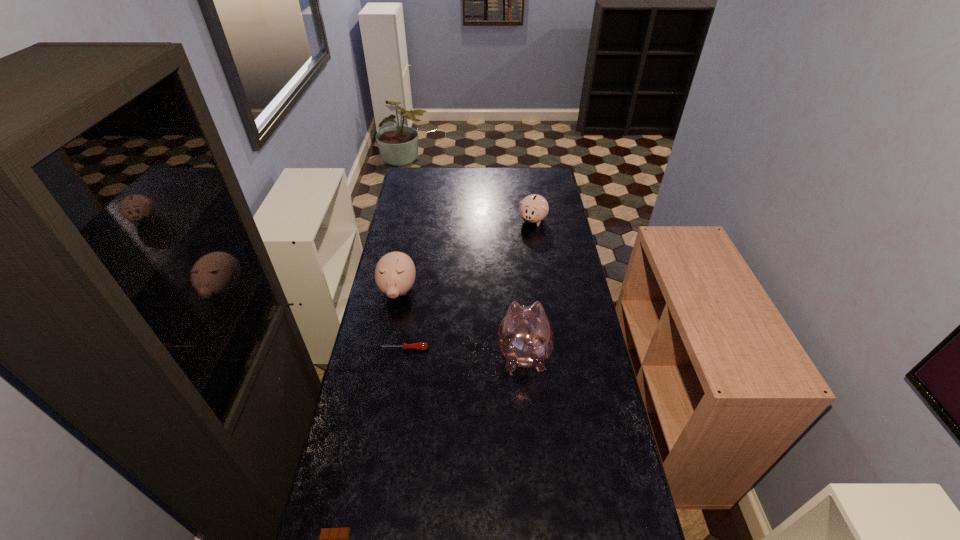
Find the location of a particular element. The height and width of the screenshot is (540, 960). vacant space located 0.290m at the snout of the second shortest piggy bank is located at coordinates (382, 372).

Locate an element on the screen. Image resolution: width=960 pixels, height=540 pixels. free spot located 0.230m on the left of the farthest object is located at coordinates (471, 220).

Where is `vacant space situated on the right of the second shortest object`? The image size is (960, 540). vacant space situated on the right of the second shortest object is located at coordinates (500, 349).

The height and width of the screenshot is (540, 960). I want to click on piggy bank that is at the left edge, so point(395,272).

Find the location of a particular element. Image resolution: width=960 pixels, height=540 pixels. screwdriver at the left edge is located at coordinates (416, 346).

Find the location of a particular element. The image size is (960, 540). object that is at the right edge is located at coordinates (534, 208).

This screenshot has width=960, height=540. Identify the location of vacant space at the left edge. (389, 245).

Locate an element on the screen. vacant space at the right edge of the desktop is located at coordinates (545, 295).

Image resolution: width=960 pixels, height=540 pixels. In order to click on vacant space at the far left corner of the desktop in this screenshot , I will do `click(425, 173)`.

Locate an element on the screen. The image size is (960, 540). free space at the far right corner is located at coordinates tap(540, 169).